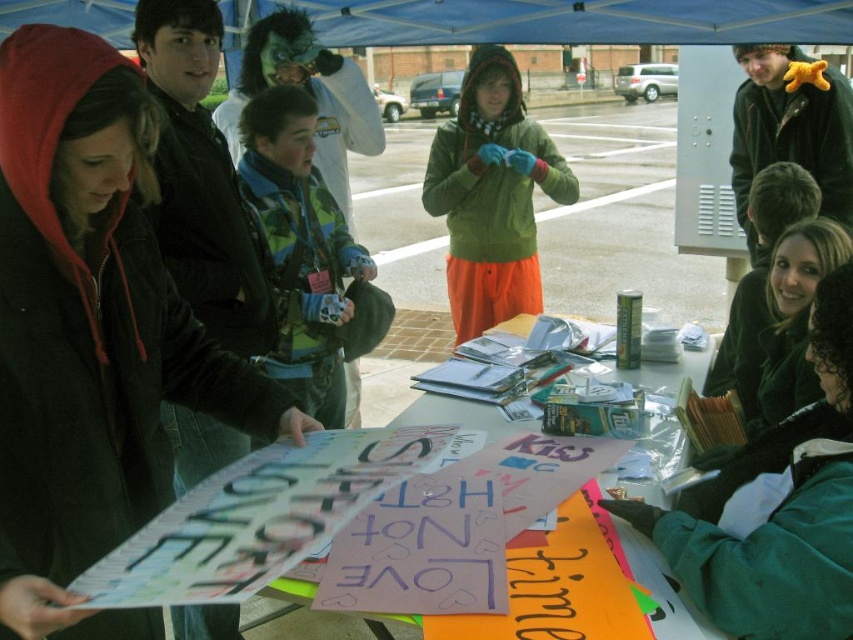
You are standing at the camera position and want to pick up the object at point (x=123, y=324). Is it within your reach without moving your feet?

The point (x=123, y=324) is 4.26 feet away from the camera, so yes, it is within reach without moving your feet.